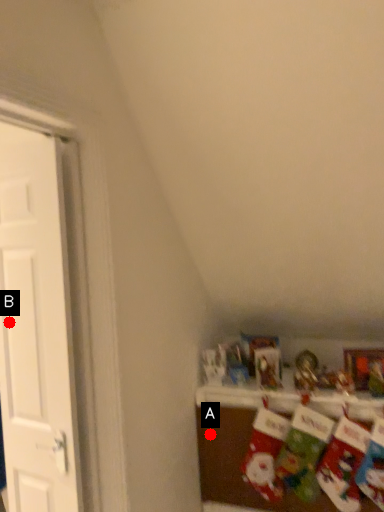
Question: Two points are circled on the image, labeled by A and B beside each circle. Among these points, which one is nearest to the camera?

Choices:
 (A) A is closer
 (B) B is closer

Answer: (B)